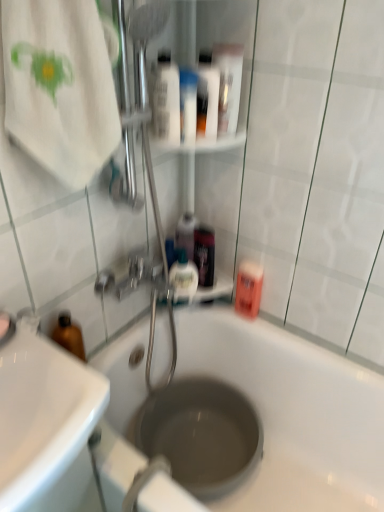
Question: Can you confirm if translucent plastic mouthwash at upper center, arranged as the 3th mouthwash when viewed from the top, is taller than white glossy tube at upper center?

Choices:
 (A) no
 (B) yes

Answer: (B)

Question: From the image's perspective, is translucent plastic mouthwash at upper center, which ranks as the 5th mouthwash in bottom-to-top order, on top of white glossy tube at upper center?

Choices:
 (A) yes
 (B) no

Answer: (A)

Question: Is translucent plastic mouthwash at upper center, which ranks as the 5th mouthwash in bottom-to-top order, positioned in front of white glossy tube at upper center?

Choices:
 (A) yes
 (B) no

Answer: (A)

Question: Is translucent plastic mouthwash at upper center, which ranks as the 5th mouthwash in bottom-to-top order, with white glossy tube at upper center?

Choices:
 (A) yes
 (B) no

Answer: (A)

Question: In terms of width, does translucent plastic mouthwash at center, placed as the fourth mouthwash when sorted from top to bottom, look wider or thinner when compared to white cotton towel at upper left?

Choices:
 (A) thin
 (B) wide

Answer: (A)

Question: From a real-world perspective, is translucent plastic mouthwash at center, acting as the fourth mouthwash starting from the bottom, positioned above or below white cotton towel at upper left?

Choices:
 (A) above
 (B) below

Answer: (B)

Question: In the image, is translucent plastic mouthwash at center, placed as the fourth mouthwash when sorted from top to bottom, positioned in front of or behind white cotton towel at upper left?

Choices:
 (A) behind
 (B) front

Answer: (A)

Question: Is translucent plastic mouthwash at center, placed as the fourth mouthwash when sorted from top to bottom, to the left or to the right of white cotton towel at upper left in the image?

Choices:
 (A) right
 (B) left

Answer: (A)

Question: Does point (31, 415) appear closer or farther from the camera than point (236, 128)?

Choices:
 (A) farther
 (B) closer

Answer: (B)

Question: Is white glossy sink at lower left wider or thinner than white glossy mouthwash at upper center, which appears as the first mouthwash when viewed from the top?

Choices:
 (A) thin
 (B) wide

Answer: (B)

Question: In terms of height, does white glossy sink at lower left look taller or shorter compared to white glossy mouthwash at upper center, the 7th mouthwash when ordered from bottom to top?

Choices:
 (A) short
 (B) tall

Answer: (A)

Question: Would you say white glossy sink at lower left is to the left or to the right of white glossy mouthwash at upper center, the 7th mouthwash when ordered from bottom to top, in the picture?

Choices:
 (A) right
 (B) left

Answer: (B)

Question: From a real-world perspective, is white glossy mouthwash at upper center, the 7th mouthwash when ordered from bottom to top, above or below white glossy sink at lower left?

Choices:
 (A) below
 (B) above

Answer: (B)

Question: Is white glossy mouthwash at upper center, which appears as the first mouthwash when viewed from the top, in front of or behind white glossy sink at lower left in the image?

Choices:
 (A) front
 (B) behind

Answer: (B)